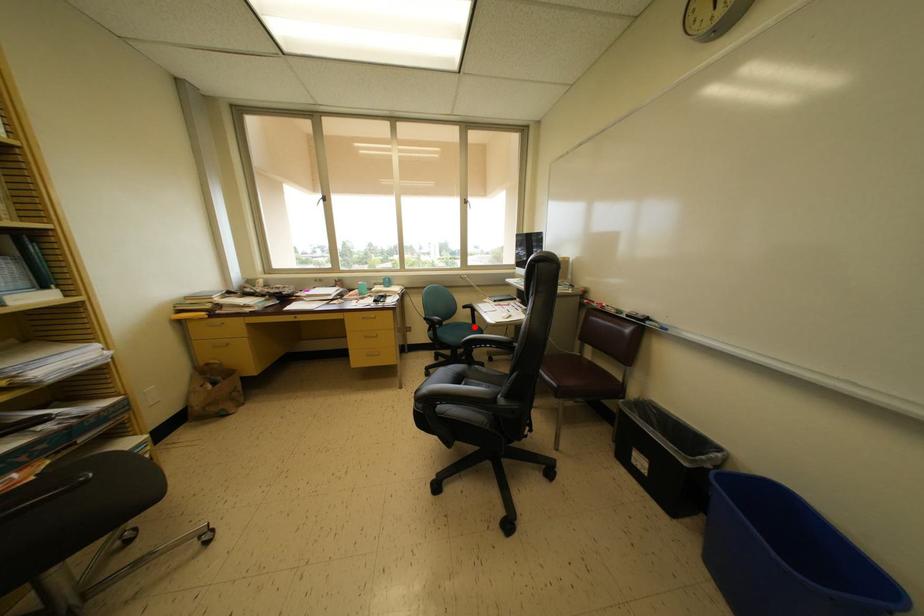
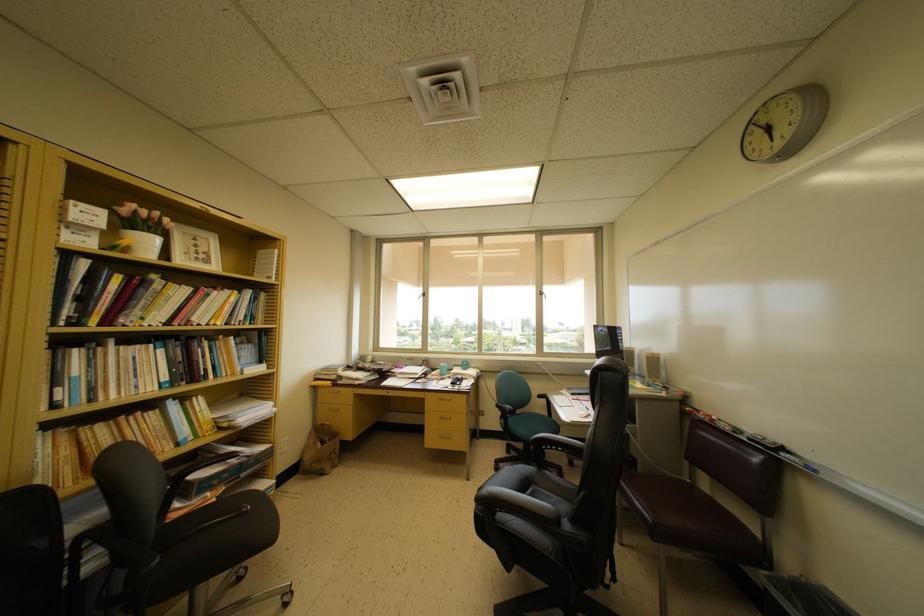
Question: I am providing you with two images of the same scene from different viewpoints. A red point is shown in image1. For the corresponding object point in image2, is it positioned nearer or farther from the camera?

Choices:
 (A) Nearer
 (B) Farther

Answer: (B)